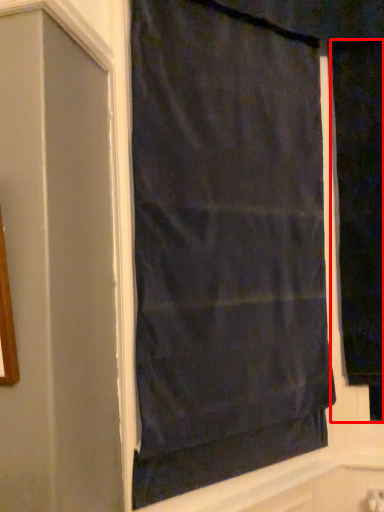
Question: From the image, what is the correct spatial relationship of curtain (annotated by the red box) in relation to curtain?

Choices:
 (A) left
 (B) right

Answer: (B)